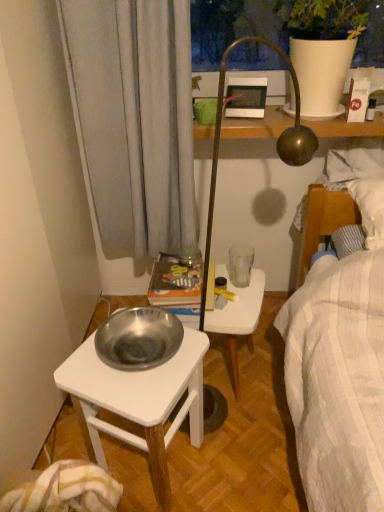
At what (x,y) coordinates should I click in order to perform the action: click on vacant area located to the right-hand side of silver metallic bowl at lower left. Please return your answer as a coordinate pair (x, y). This screenshot has height=512, width=384. Looking at the image, I should click on (243, 458).